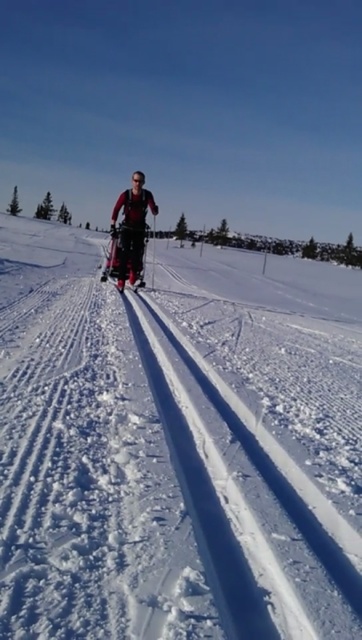
Between white smooth snow at center and matte black skisuit at center, which one appears on the left side from the viewer's perspective?

From the viewer's perspective, matte black skisuit at center appears more on the left side.

Can you confirm if white smooth snow at center is thinner than matte black skisuit at center?

In fact, white smooth snow at center might be wider than matte black skisuit at center.

What do you see at coordinates (173, 451) in the screenshot?
I see `white smooth snow at center` at bounding box center [173, 451].

At what (x,y) coordinates should I click in order to perform the action: click on white smooth snow at center. Please return your answer as a coordinate pair (x, y). The width and height of the screenshot is (362, 640). Looking at the image, I should click on (173, 451).